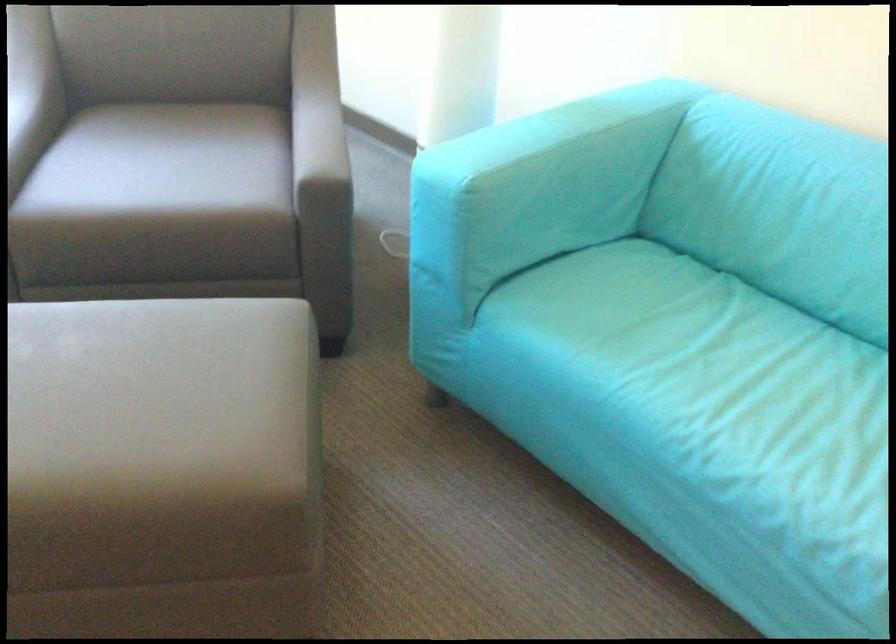
Identify the location of blue sofa sitting surface. The image size is (896, 644). (699, 353).